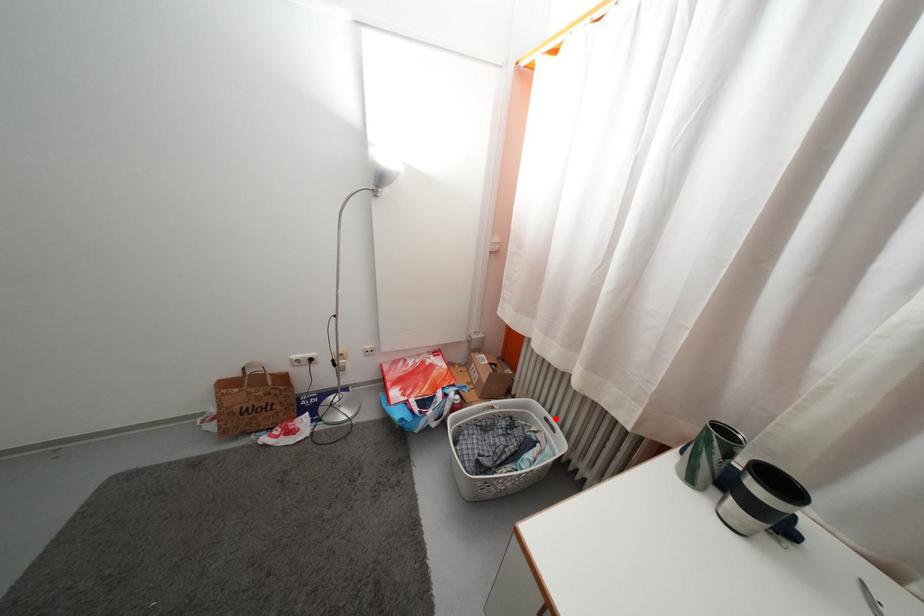
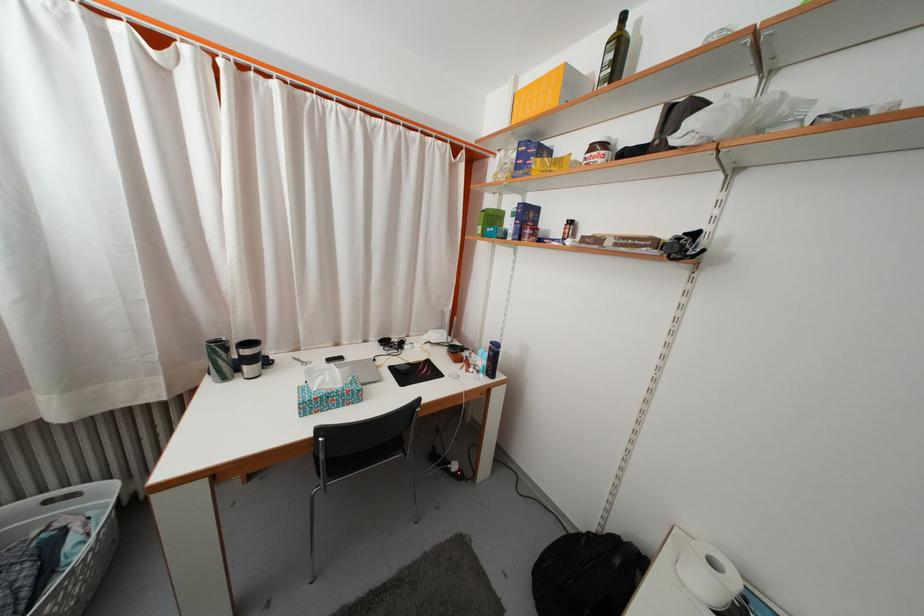
Question: I am providing you with two images of the same scene from different viewpoints. Image1 has a red point marked. In image2, the corresponding 3D location appears at what relative position? Reply with the corresponding letter.

Choices:
 (A) Closer
 (B) Farther

Answer: (A)